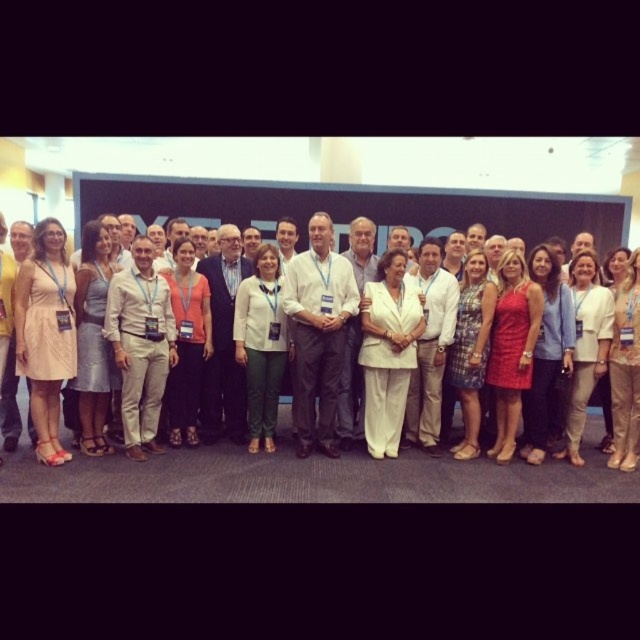
Can you confirm if white cotton dress at center is shorter than white fabric suit at center?

Yes.

Between point (100, 252) and point (292, 333), which one is positioned in front?

Point (100, 252)

I want to click on white cotton dress at center, so click(x=65, y=330).

Identify the location of white cotton dress at center. This screenshot has width=640, height=640. (65, 330).